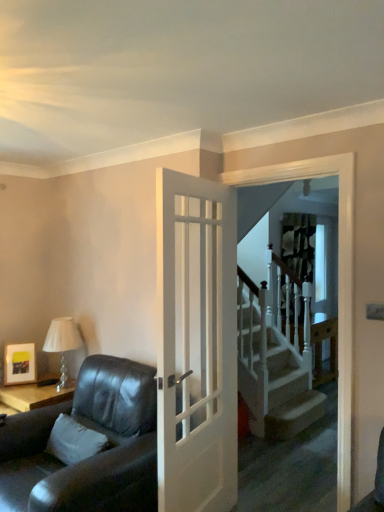
At what (x,y) coordinates should I click in order to perform the action: click on wooden at right. Please return your answer as a coordinate pair (x, y). The height and width of the screenshot is (512, 384). Looking at the image, I should click on (321, 350).

The height and width of the screenshot is (512, 384). Describe the element at coordinates (20, 364) in the screenshot. I see `matte black picture frame at upper left` at that location.

The height and width of the screenshot is (512, 384). Describe the element at coordinates (313, 256) in the screenshot. I see `patterned fabric curtain at upper center` at that location.

Where is `white glass table lamp at left`? The width and height of the screenshot is (384, 512). white glass table lamp at left is located at coordinates (63, 345).

From the picture: What is the approximate height of white glossy screen door at upper center?

white glossy screen door at upper center is 7.04 feet in height.

Consider the image. Measure the distance between point [175,399] and camera.

Point [175,399] is 2.07 meters away from camera.

Find the location of a particular element. The width and height of the screenshot is (384, 512). wooden at right is located at coordinates (321, 350).

Is white glossy door at center taller or shorter than white glass table lamp at left?

white glossy door at center is taller than white glass table lamp at left.

Choose the correct answer: Is white glossy door at center inside white glass table lamp at left or outside it?

white glossy door at center exists outside the volume of white glass table lamp at left.

Considering the relative positions of white glossy door at center and white glass table lamp at left in the image provided, is white glossy door at center in front of white glass table lamp at left?

Yes, it is.

How distant is white glossy door at center from white glass table lamp at left?

3.98 feet.

Where is `window located on the right of white glass table lamp at left`? Image resolution: width=384 pixels, height=512 pixels. window located on the right of white glass table lamp at left is located at coordinates (313, 256).

Would you consider white glass table lamp at left to be distant from patterned fabric curtain at upper center?

Yes, white glass table lamp at left and patterned fabric curtain at upper center are located far from each other.

Is white glass table lamp at left positioned with its back to patterned fabric curtain at upper center?

Yes.

From the image's perspective, would you say white glass table lamp at left is positioned over patterned fabric curtain at upper center?

Incorrect, from the image's perspective, white glass table lamp at left is lower than patterned fabric curtain at upper center.

Considering the sizes of objects matte black picture frame at upper left and white soft pillow at lower left in the image provided, who is thinner, matte black picture frame at upper left or white soft pillow at lower left?

Thinner between the two is white soft pillow at lower left.

From the image's perspective, is matte black picture frame at upper left beneath white soft pillow at lower left?

Actually, matte black picture frame at upper left appears above white soft pillow at lower left in the image.

Does matte black picture frame at upper left turn towards white soft pillow at lower left?

Yes.

Looking at this image, is leather couch at left in front of patterned fabric curtain at upper center?

Yes, the depth of leather couch at left is less than that of patterned fabric curtain at upper center.

How far apart are leather couch at left and patterned fabric curtain at upper center?

They are 2.82 meters apart.

Is leather couch at left far away from patterned fabric curtain at upper center?

leather couch at left is far away from patterned fabric curtain at upper center.

Is leather couch at left bigger than patterned fabric curtain at upper center?

Correct, leather couch at left is larger in size than patterned fabric curtain at upper center.

You are a GUI agent. You are given a task and a screenshot of the screen. Output one action in this format:
    pyautogui.click(x=<x>, y=<y>)
    Task: Click on the studio couch in front of the white glass table lamp at left
    The image size is (384, 512).
    Given the screenshot: What is the action you would take?
    pyautogui.click(x=92, y=456)

Is leather couch at left facing towards white glass table lamp at left?

No, leather couch at left is not facing towards white glass table lamp at left.

Between leather couch at left and white glass table lamp at left, which one appears on the left side from the viewer's perspective?

From the viewer's perspective, white glass table lamp at left appears more on the left side.

Which is behind, point (93, 367) or point (70, 347)?

Positioned behind is point (70, 347).

Considering the positions of points (173, 431) and (54, 490), is point (173, 431) closer to camera compared to point (54, 490)?

No, it is not.

What are the coordinates of `studio couch in front of the white glossy door at center` in the screenshot? It's located at (92, 456).

Between white glossy door at center and leather couch at left, which one has larger size?

leather couch at left is bigger.

Is white glossy door at center in contact with leather couch at left?

They are not placed beside each other.

Is matte black picture frame at upper left facing towards patterned fabric curtain at upper center?

No, matte black picture frame at upper left is not facing towards patterned fabric curtain at upper center.

In the image, is matte black picture frame at upper left positioned in front of or behind patterned fabric curtain at upper center?

Visually, matte black picture frame at upper left is located in front of patterned fabric curtain at upper center.

In order to click on window located above the matte black picture frame at upper left (from the image's perspective) in this screenshot , I will do `click(313, 256)`.

Are matte black picture frame at upper left and patterned fabric curtain at upper center located far from each other?

matte black picture frame at upper left is positioned a significant distance from patterned fabric curtain at upper center.

In order to click on door above the white glass table lamp at left (from the image's perspective) in this screenshot , I will do `click(196, 344)`.

Find the location of `window behind the white glass table lamp at left`. window behind the white glass table lamp at left is located at coordinates (313, 256).

Considering their positions, is white glossy door at center positioned closer to wooden at right than patterned fabric curtain at upper center?

patterned fabric curtain at upper center is closer to wooden at right.

From the image, which object appears to be farther from matte black picture frame at upper left, white glossy door at center or wooden at right?

Based on the image, wooden at right appears to be further to matte black picture frame at upper left.

Based on their spatial positions, is leather couch at left or patterned fabric curtain at upper center closer to white soft pillow at lower left?

Among the two, leather couch at left is located nearer to white soft pillow at lower left.

Looking at the image, which one is located further to matte black picture frame at upper left, white glossy door at center or patterned fabric curtain at upper center?

patterned fabric curtain at upper center.

Considering their positions, is matte black picture frame at upper left positioned closer to wooden at right than white glass table lamp at left?

white glass table lamp at left is closer to wooden at right.

Estimate the real-world distances between objects in this image. Which object is further from matte black picture frame at upper left, white glossy door at center or white glass table lamp at left?

white glossy door at center is further to matte black picture frame at upper left.

Looking at this image, when comparing their distances from leather couch at left, does white glass table lamp at left or white soft pillow at lower left seem closer?

white soft pillow at lower left is positioned closer to the anchor leather couch at left.

Looking at this image, estimate the real-world distances between objects in this image. Which object is further from white glossy screen door at upper center, leather couch at left or matte black picture frame at upper left?

matte black picture frame at upper left is further to white glossy screen door at upper center.

This screenshot has width=384, height=512. Find the location of `studio couch located between matte black picture frame at upper left and white glossy screen door at upper center in the left-right direction`. studio couch located between matte black picture frame at upper left and white glossy screen door at upper center in the left-right direction is located at coordinates (92, 456).

Identify the location of studio couch located between white glass table lamp at left and white glossy screen door at upper center in the left-right direction. This screenshot has width=384, height=512. (92, 456).

Where is `door positioned between leather couch at left and white glass table lamp at left from near to far`? door positioned between leather couch at left and white glass table lamp at left from near to far is located at coordinates (196, 344).

Locate an element on the screen. The height and width of the screenshot is (512, 384). screen door between white glossy door at center and patterned fabric curtain at upper center in the front-back direction is located at coordinates (338, 284).